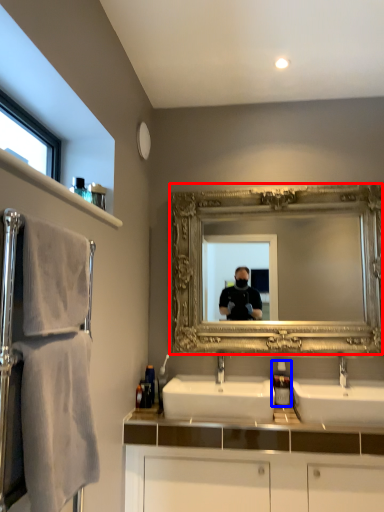
Question: Which object appears closest to the camera in this image, mirror (highlighted by a red box) or soap dispenser (highlighted by a blue box)?

Choices:
 (A) mirror
 (B) soap dispenser

Answer: (A)